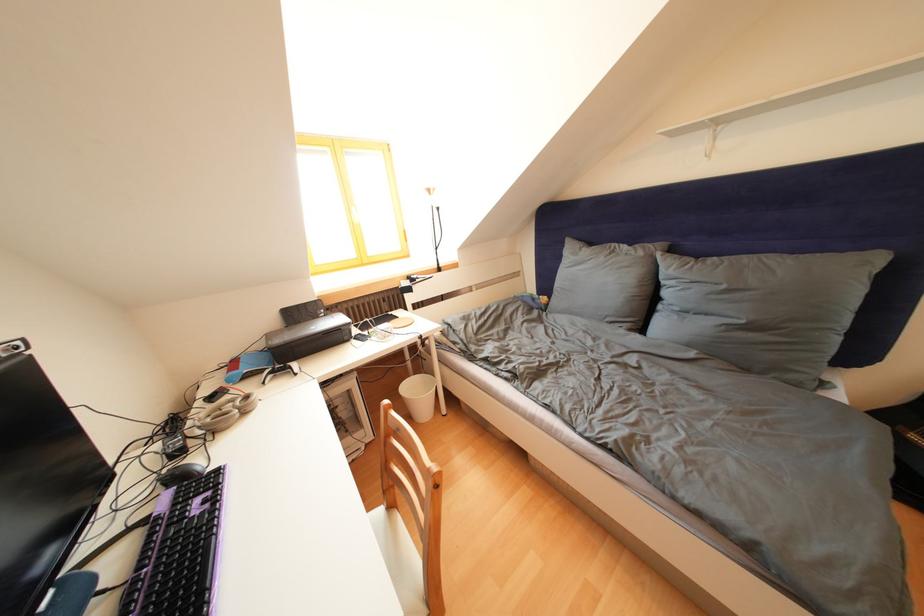
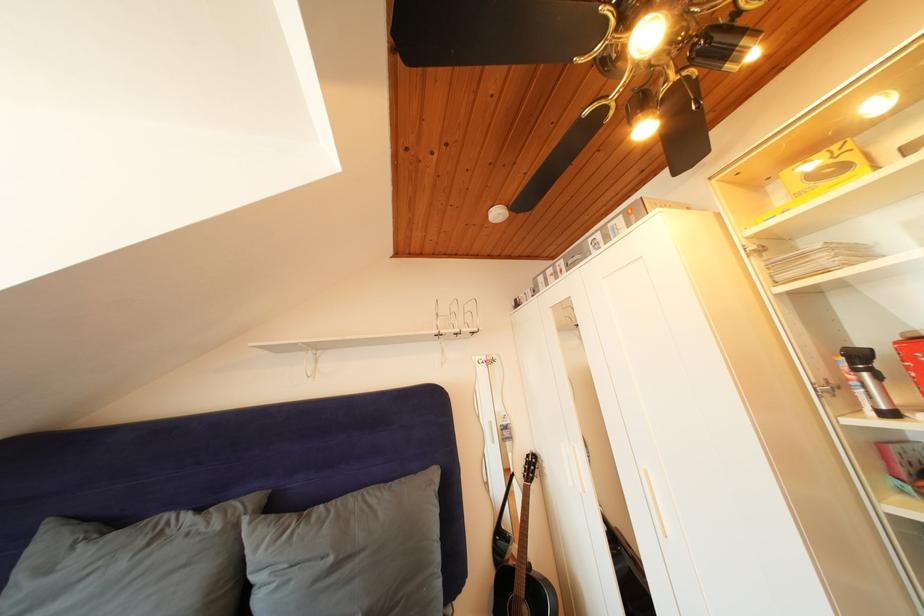
The images are taken continuously from a first-person perspective. In which direction is your viewpoint rotating?

The rotation direction of the camera is right-up.